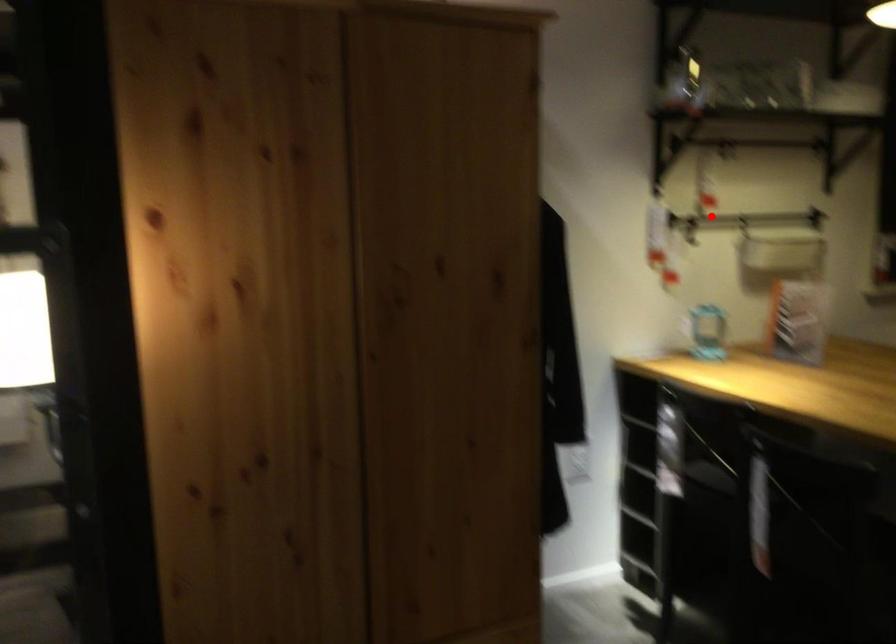
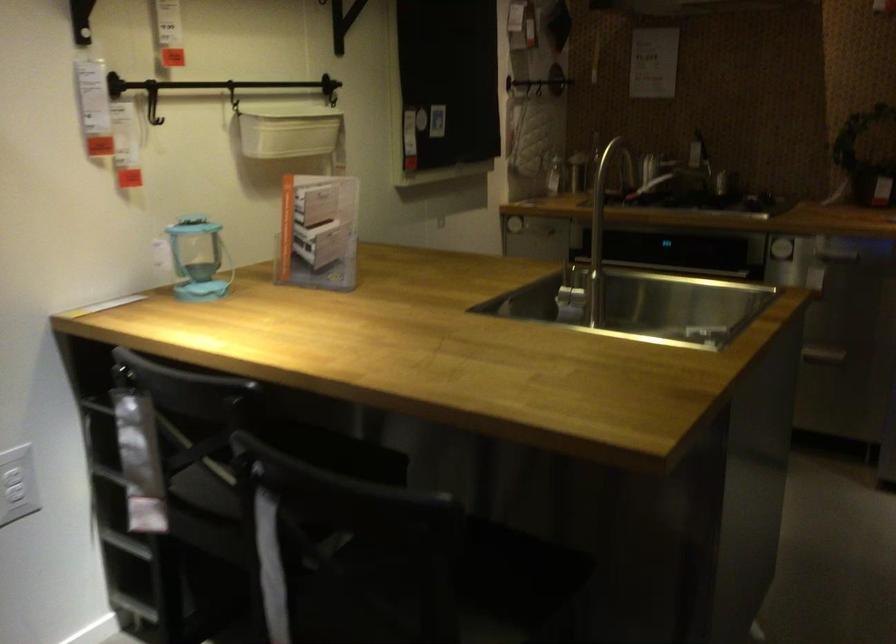
Question: I am providing you with two images of the same scene from different viewpoints. Image1 has a red point marked. In image2, the corresponding 3D location appears at what relative position? Reply with the corresponding letter.

Choices:
 (A) Closer
 (B) Farther

Answer: (A)